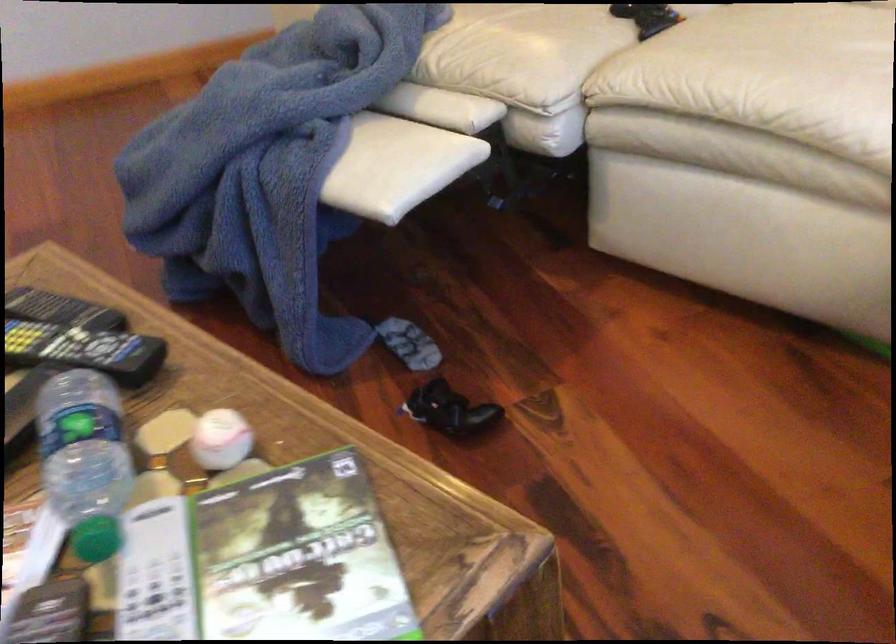
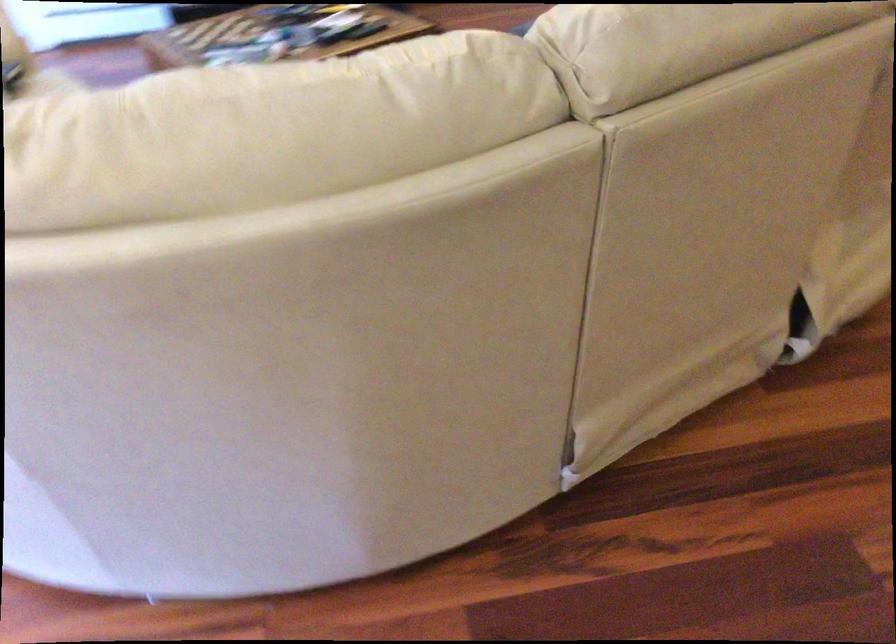
Question: I am providing you with two images of the same scene from different viewpoints. After the viewpoint changes to image2, which objects are now occluded?

Choices:
 (A) white sofa sitting surface
 (B) sofa armrest
 (C) sofa sitting surface
 (D) cat-shaped pillow

Answer: (A)